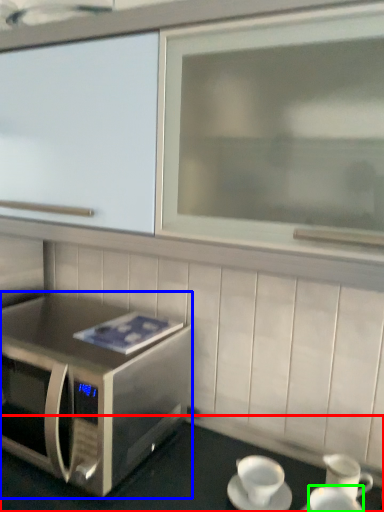
Question: Based on their relative distances, which object is nearer to table (highlighted by a red box)? Choose from microwave oven (highlighted by a blue box) and coffee cup (highlighted by a green box).

Choices:
 (A) microwave oven
 (B) coffee cup

Answer: (A)